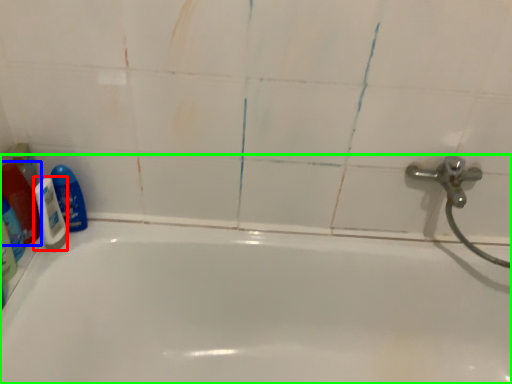
Question: Which object is positioned farthest from shaving cream (highlighted by a red box)? Select from cleaning product (highlighted by a blue box) and bathtub (highlighted by a green box).

Choices:
 (A) cleaning product
 (B) bathtub

Answer: (B)